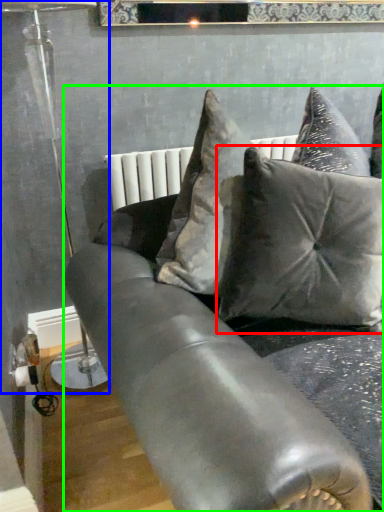
Question: Which is farther away from pillow (highlighted by a red box)? lamp (highlighted by a blue box) or studio couch (highlighted by a green box)?

Choices:
 (A) lamp
 (B) studio couch

Answer: (A)